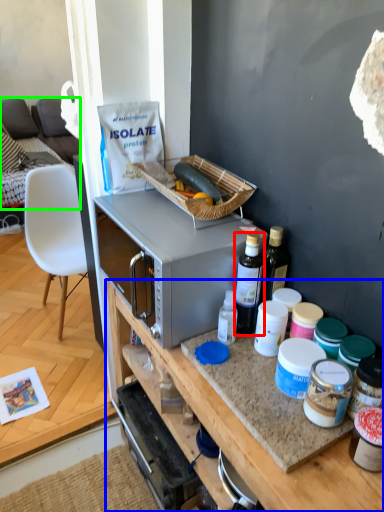
Question: Which object is the farthest from bottle (highlighted by a red box)? Choose among these: desk (highlighted by a blue box) or cabinetry (highlighted by a green box).

Choices:
 (A) desk
 (B) cabinetry

Answer: (B)